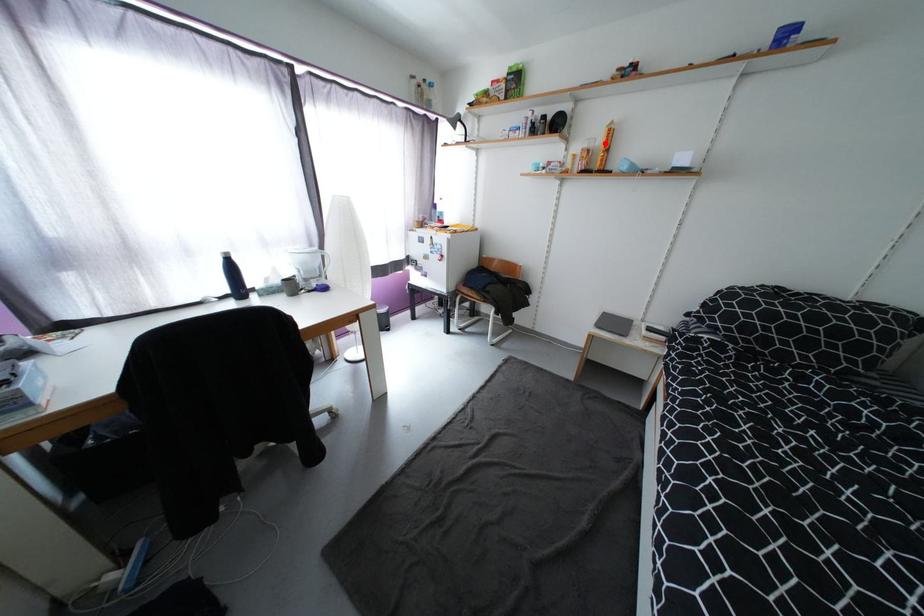
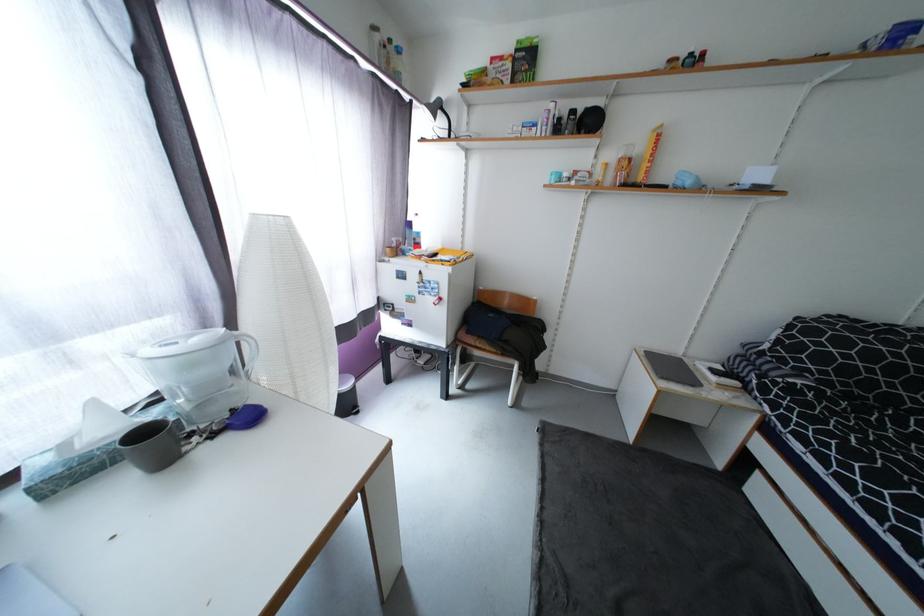
Find the pixel in the second image that matches the highlighted location in the first image.

(647, 151)